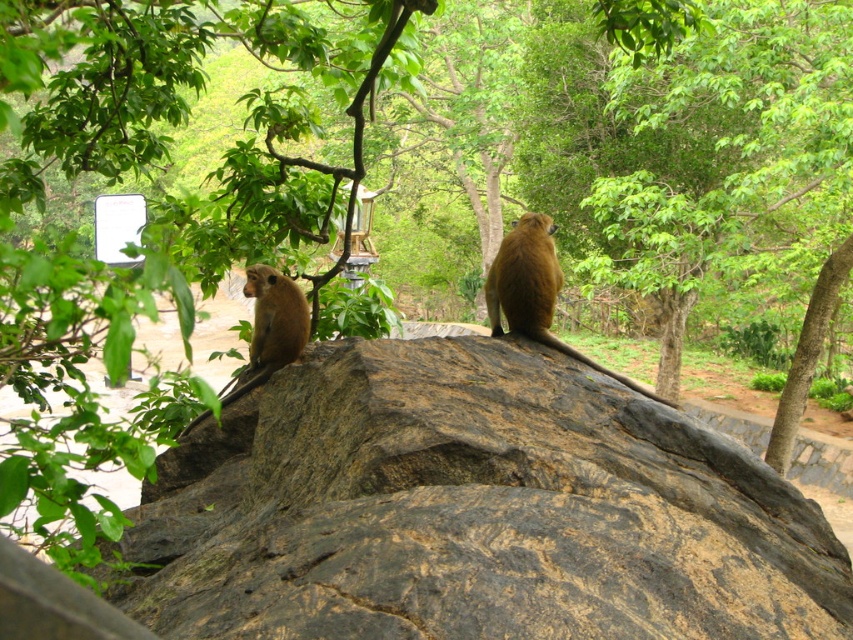
Describe the element at coordinates (473, 509) in the screenshot. I see `brown rough rock at center` at that location.

Does brown rough rock at center have a smaller size compared to golden fur monkey at center?

Actually, brown rough rock at center might be larger than golden fur monkey at center.

Locate an element on the screen. The width and height of the screenshot is (853, 640). brown rough rock at center is located at coordinates pyautogui.click(x=473, y=509).